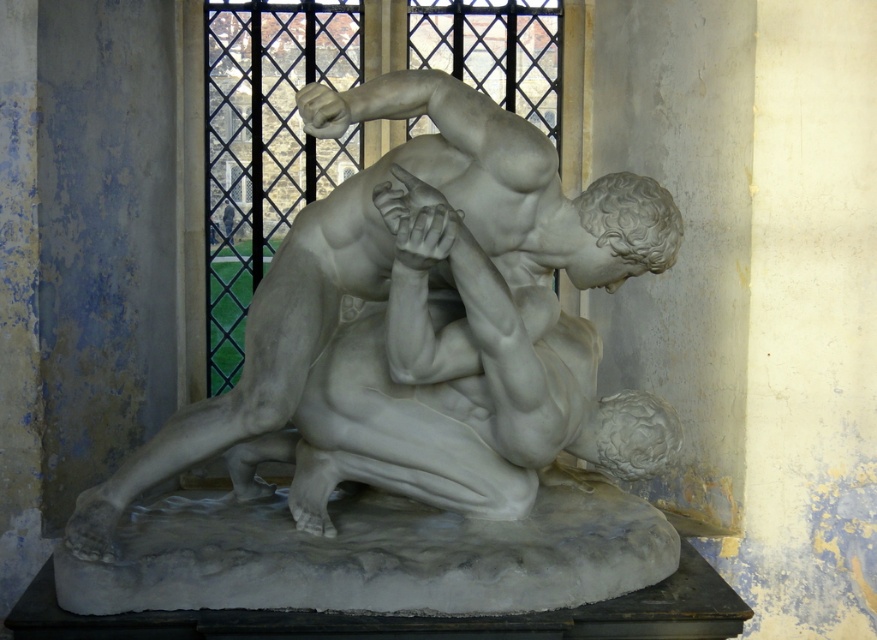
Does white marble statue at center appear on the left side of white marble base at lower center?

Correct, you'll find white marble statue at center to the left of white marble base at lower center.

Is white marble statue at center further to camera compared to white marble base at lower center?

That is False.

Between point (164, 472) and point (405, 518), which one is positioned in front?

Point (164, 472) is more forward.

Locate an element on the screen. Image resolution: width=877 pixels, height=640 pixels. white marble statue at center is located at coordinates (425, 326).

In the scene shown: Does white marble statue at center appear on the right side of clear glass window at center?

Yes, white marble statue at center is to the right of clear glass window at center.

Does white marble statue at center lie behind clear glass window at center?

That is False.

Locate an element on the screen. white marble statue at center is located at coordinates (x=425, y=326).

Who is taller, white marble base at lower center or clear glass window at center?

clear glass window at center is taller.

Who is more forward, (x=98, y=609) or (x=523, y=12)?

Point (x=98, y=609) is more forward.

At what (x,y) coordinates should I click in order to perform the action: click on white marble base at lower center. Please return your answer as a coordinate pair (x, y). Image resolution: width=877 pixels, height=640 pixels. Looking at the image, I should click on (375, 554).

Find the location of a particular element. This screenshot has width=877, height=640. white marble base at lower center is located at coordinates (375, 554).